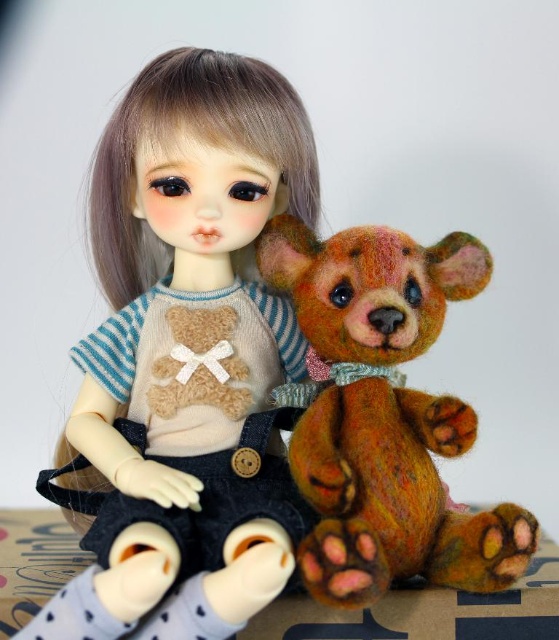
Is point (305, 182) positioned after point (530, 556)?

That is True.

Who is more forward, (107, 624) or (377, 528)?

Point (107, 624) is more forward.

Identify the location of matte beige doll at center. pyautogui.click(x=187, y=355).